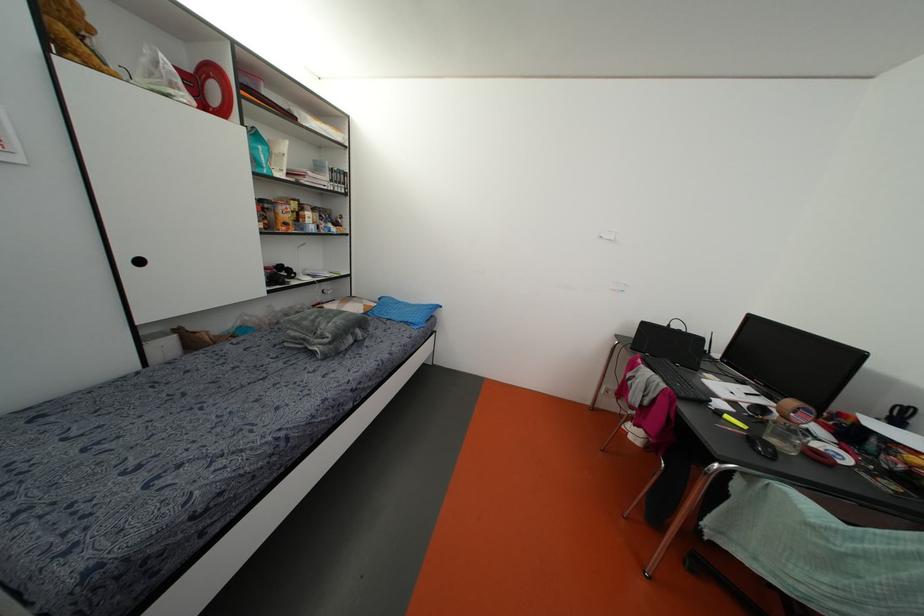
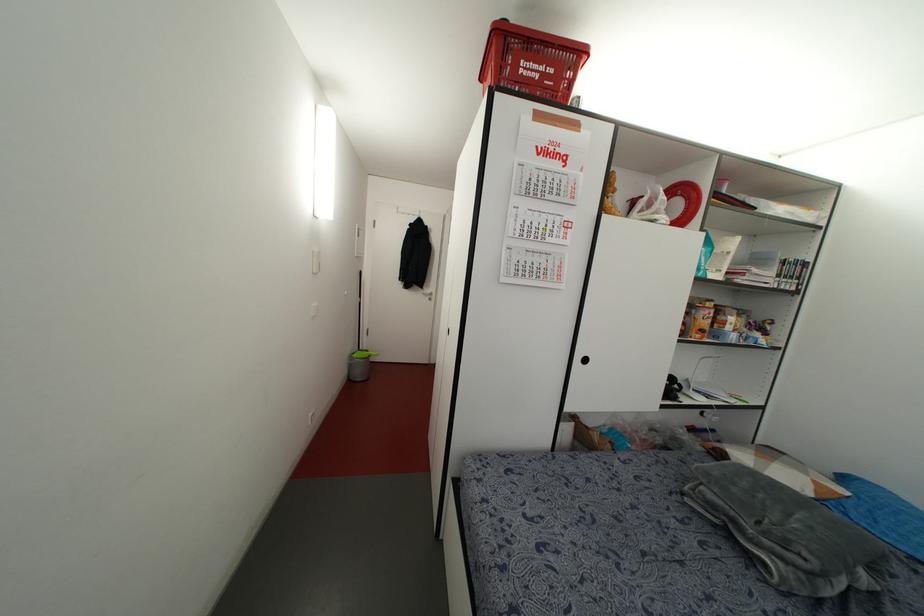
Question: The camera is either moving clockwise (left) or counter-clockwise (right) around the object. The first image is from the beginning of the video and the second image is from the end. Is the camera moving left or right when shooting the video?

Choices:
 (A) Left
 (B) Right

Answer: (B)